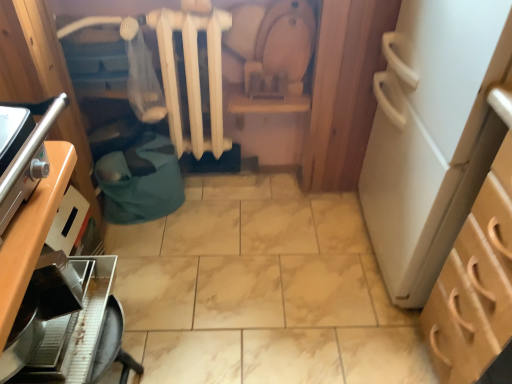
Question: Is light brown wood cabinet at right, the second cabinetry viewed from the left, in front of or behind wooden cabinet at left, marked as the first cabinetry in a left-to-right arrangement, in the image?

Choices:
 (A) front
 (B) behind

Answer: (B)

Question: Looking at the image, does light brown wood cabinet at right, the second cabinetry viewed from the left, seem bigger or smaller compared to wooden cabinet at left, the second cabinetry viewed from the right?

Choices:
 (A) big
 (B) small

Answer: (A)

Question: Which object is positioned farthest from the wooden cabinet at left, the second cabinetry viewed from the right?

Choices:
 (A) metallic silver coffee maker at lower left
 (B) light brown wood cabinet at right, the second cabinetry viewed from the left
 (C) white matte radiator at center

Answer: (B)

Question: Which of these objects is positioned closest to the light brown wood cabinet at right, the second cabinetry viewed from the left?

Choices:
 (A) metallic silver coffee maker at lower left
 (B) wooden cabinet at left, the second cabinetry viewed from the right
 (C) white matte radiator at center

Answer: (A)